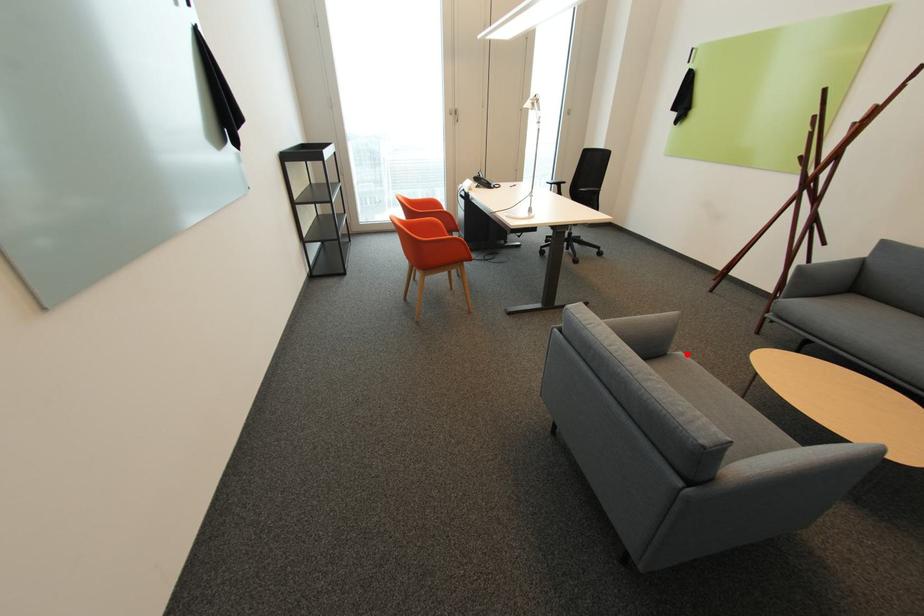
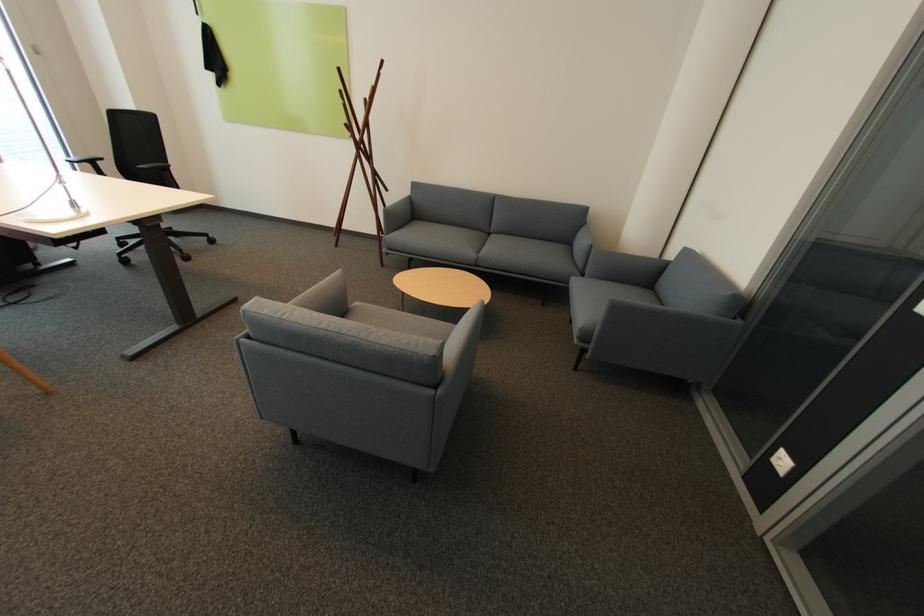
Question: I am providing you with two images of the same scene from different viewpoints. Given a red point in image1, look at the same physical point in image2. Is it:

Choices:
 (A) Closer to the viewpoint
 (B) Farther from the viewpoint

Answer: (A)